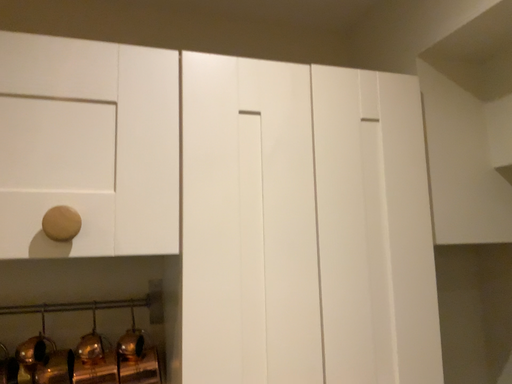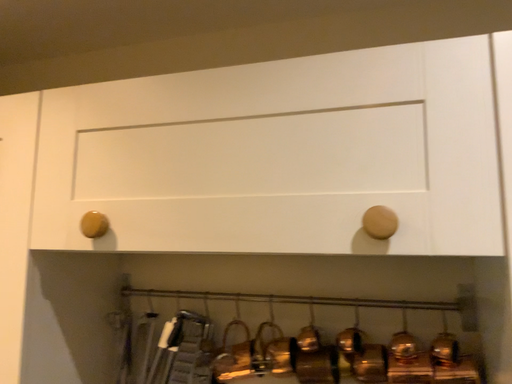
Question: Which way did the camera rotate in the video?

Choices:
 (A) rotated right
 (B) rotated left

Answer: (B)